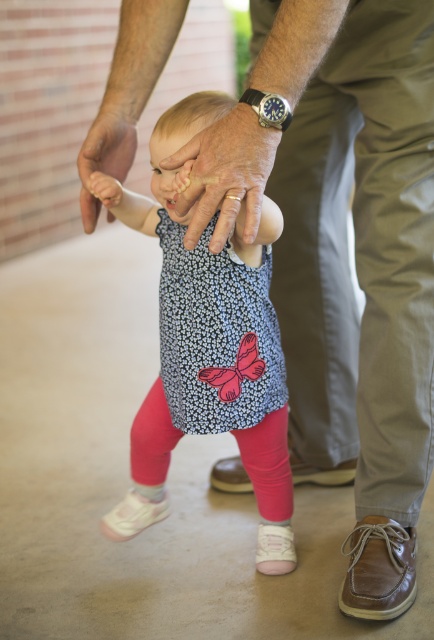
Question: Does floral dress at center have a greater width compared to matte skin hand at lower left?

Choices:
 (A) no
 (B) yes

Answer: (B)

Question: Which point is closer to the camera?

Choices:
 (A) (85, 214)
 (B) (368, 518)
 (C) (157, 380)

Answer: (A)

Question: Based on their relative distances, which object is nearer to the matte skin hand at lower left?

Choices:
 (A) brown leather shoe at lower right
 (B) floral dress at center

Answer: (B)

Question: Does matte skin hand at lower left appear over brown leather shoe at lower center?

Choices:
 (A) no
 (B) yes

Answer: (B)

Question: Which object is positioned farthest from the matte skin hand at center?

Choices:
 (A) white suede shoe at lower center
 (B) floral dress at center
 (C) brown leather shoe at lower center

Answer: (C)

Question: Can you confirm if floral dress at center is wider than white suede shoe at lower center?

Choices:
 (A) yes
 (B) no

Answer: (A)